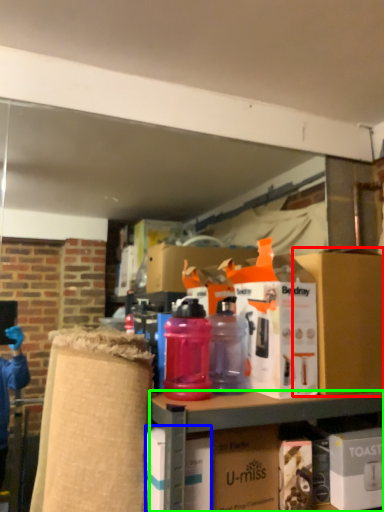
Question: Based on their relative distances, which object is farther from box (highlighted by a red box)? Choose from box (highlighted by a blue box) and cabinetry (highlighted by a green box).

Choices:
 (A) box
 (B) cabinetry

Answer: (A)